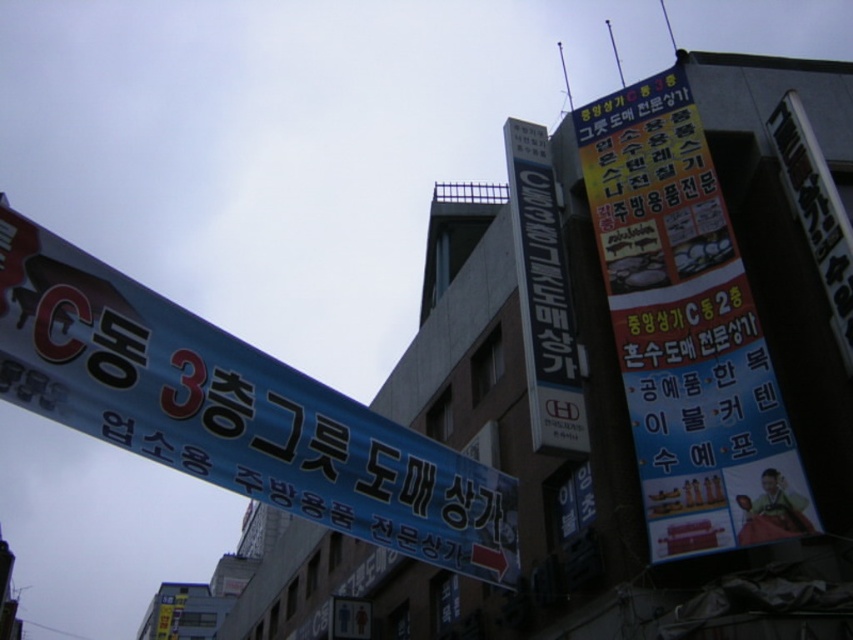
Between point (372, 428) and point (717, 456), which one is positioned in front?

Point (372, 428)

Who is shorter, blue plastic banner at upper left or yellow paper sign at upper right?

blue plastic banner at upper left

Does point (100, 438) lie in front of point (723, 476)?

Yes, it is in front of point (723, 476).

Identify the location of blue plastic banner at upper left. The image size is (853, 640). (233, 412).

You are a GUI agent. You are given a task and a screenshot of the screen. Output one action in this format:
    pyautogui.click(x=<x>, y=<y>)
    Task: Click on the yellow paper sign at upper right
    Image resolution: width=853 pixels, height=640 pixels.
    Given the screenshot: What is the action you would take?
    pyautogui.click(x=686, y=330)

Who is positioned more to the left, yellow paper sign at upper right or blue metallic sign at center?

From the viewer's perspective, blue metallic sign at center appears more on the left side.

At what (x,y) coordinates should I click in order to perform the action: click on yellow paper sign at upper right. Please return your answer as a coordinate pair (x, y). Image resolution: width=853 pixels, height=640 pixels. Looking at the image, I should click on pos(686,330).

Find the location of `yellow paper sign at upper right`. yellow paper sign at upper right is located at coordinates (686, 330).

Does blue plastic banner at upper left have a greater width compared to blue metallic sign at center?

Yes, blue plastic banner at upper left is wider than blue metallic sign at center.

Is blue plastic banner at upper left bigger than blue metallic sign at center?

Correct, blue plastic banner at upper left is larger in size than blue metallic sign at center.

Is point (76, 394) closer to viewer compared to point (547, 182)?

Yes, point (76, 394) is closer to viewer.

You are a GUI agent. You are given a task and a screenshot of the screen. Output one action in this format:
    pyautogui.click(x=<x>, y=<y>)
    Task: Click on the blue plastic banner at upper left
    This screenshot has width=853, height=640.
    Given the screenshot: What is the action you would take?
    pyautogui.click(x=233, y=412)